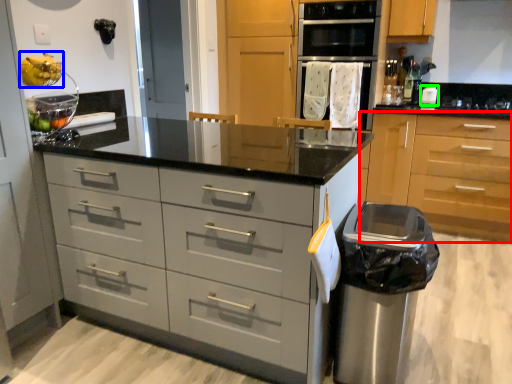
Question: Which object is the closest to the cabinetry (highlighted by a red box)? Choose among these: fruit (highlighted by a blue box) or kitchen appliance (highlighted by a green box).

Choices:
 (A) fruit
 (B) kitchen appliance

Answer: (B)